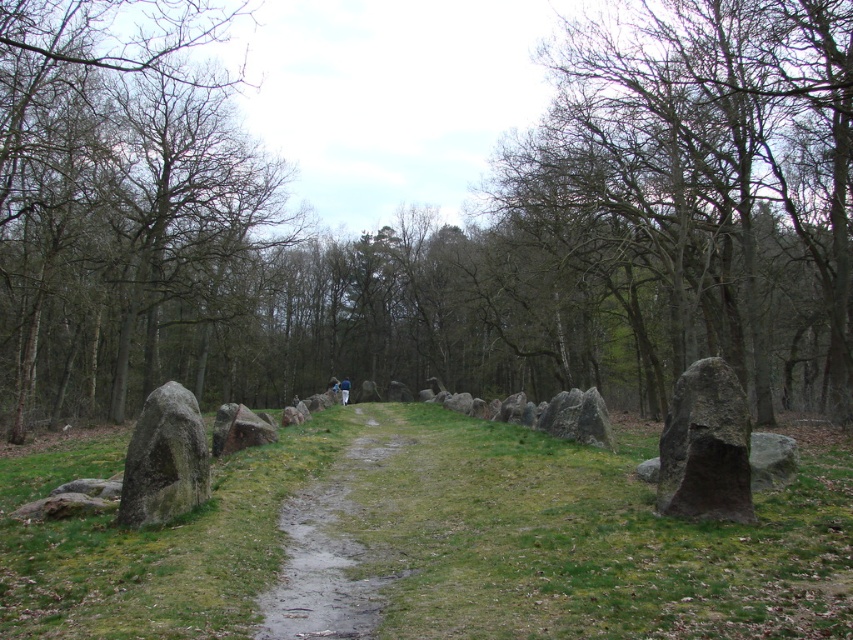
In the scene shown: You are standing on the path in the forest scene and want to walk towards the two points marked in the image. Which point, point (749, 509) or point (231, 420), will you reach first?

Point (749, 509) is closer to the viewer than point (231, 420), so you will reach point (749, 509) first.

You are standing at the entrance of the forest and see the damp dirt path at center. If you were to draw a map of the path, where would you mark its central point?

The damp dirt path at center has its central point at coordinates (x=329, y=547).

You are a hiker standing on the path and want to place a small flag between the dark gray stone at right and the gray stone boulder at center. Based on their positions, where should you place the flag so it is between them?

You should place the flag below the dark gray stone at right and above the gray stone boulder at center since the dark gray stone at right is located above the gray stone boulder at center.